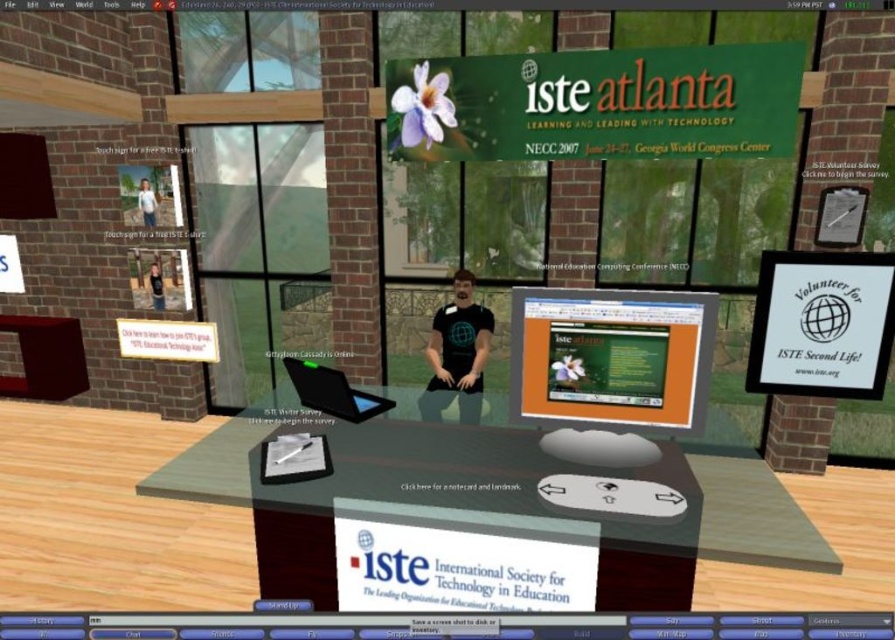
Question: Among these points, which one is nearest to the camera?

Choices:
 (A) (156, 202)
 (B) (448, 400)

Answer: (B)

Question: Which point appears closest to the camera in this image?

Choices:
 (A) (437, 337)
 (B) (155, 204)

Answer: (A)

Question: Among these objects, which one is nearest to the camera?

Choices:
 (A) matte black t-shirt at center
 (B) shiny black laptop at center
 (C) light blue shirt at left

Answer: (B)

Question: Is matte orange monitor at center to the left of matte black t-shirt at center from the viewer's perspective?

Choices:
 (A) no
 (B) yes

Answer: (A)

Question: Does matte black t-shirt at center have a lesser width compared to shiny black laptop at center?

Choices:
 (A) no
 (B) yes

Answer: (A)

Question: Is matte orange monitor at center smaller than light blue shirt at left?

Choices:
 (A) yes
 (B) no

Answer: (B)